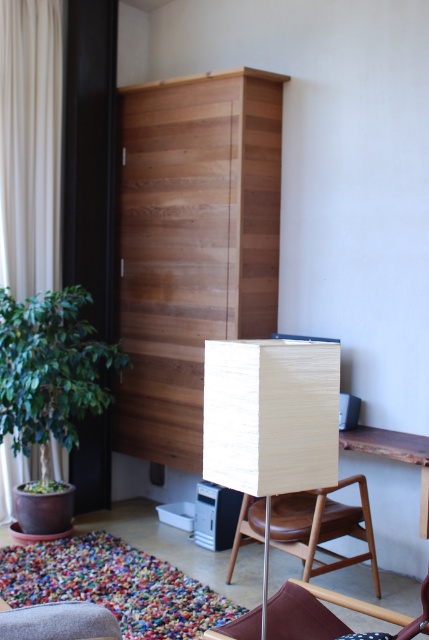
Does matte wood lamp at center have a smaller size compared to wooden armchair at center?

Correct, matte wood lamp at center occupies less space than wooden armchair at center.

Which is below, matte wood lamp at center or wooden armchair at center?

wooden armchair at center is below.

Image resolution: width=429 pixels, height=640 pixels. Identify the location of matte wood lamp at center. (271, 419).

Which is more to the right, beige fabric curtain at left or wooden armchair at center?

From the viewer's perspective, wooden armchair at center appears more on the right side.

Is beige fabric curtain at left thinner than wooden armchair at center?

Correct, beige fabric curtain at left's width is less than wooden armchair at center's.

Identify the location of beige fabric curtain at left. (30, 145).

Locate an element on the screen. beige fabric curtain at left is located at coordinates (30, 145).

What do you see at coordinates (322, 528) in the screenshot?
I see `wooden armchair at center` at bounding box center [322, 528].

Does wooden armchair at center have a larger size compared to velvet burgundy armchair at lower center?

Yes.

Does point (299, 525) come in front of point (425, 612)?

No, it is behind (425, 612).

This screenshot has height=640, width=429. In order to click on wooden armchair at center in this screenshot , I will do `click(322, 528)`.